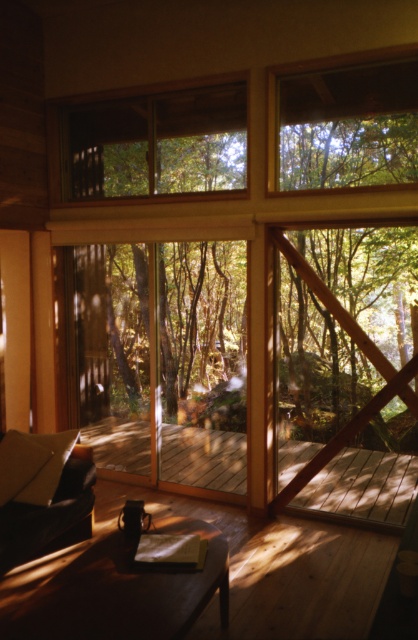
Question: Which object appears closest to the camera in this image?

Choices:
 (A) wooden deck at center
 (B) clear glass window at upper center

Answer: (B)

Question: Does clear glass window at upper center have a larger size compared to wooden deck at center?

Choices:
 (A) yes
 (B) no

Answer: (A)

Question: Which object appears farthest from the camera in this image?

Choices:
 (A) clear glass window at upper center
 (B) wooden deck at center

Answer: (B)

Question: Is clear glass window at upper center behind wooden deck at center?

Choices:
 (A) no
 (B) yes

Answer: (A)

Question: Does clear glass window at upper center have a smaller size compared to wooden deck at center?

Choices:
 (A) no
 (B) yes

Answer: (A)

Question: Which point is closer to the camera?

Choices:
 (A) wooden deck at center
 (B) clear glass window at upper center

Answer: (B)